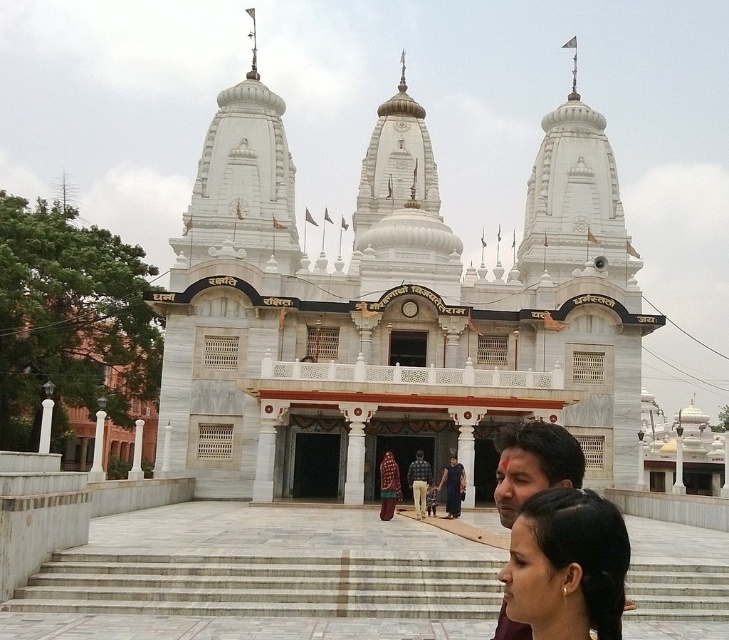
Question: From the image, what is the correct spatial relationship of white marble stairs at center in relation to black hair at lower center?

Choices:
 (A) below
 (B) above

Answer: (A)

Question: Which point is farther from the camera taking this photo?

Choices:
 (A) (389, 476)
 (B) (421, 488)
 (C) (534, 572)
 (D) (389, 580)

Answer: (B)

Question: Does white marble stairs at center have a lesser width compared to dark brown fabric dress at center?

Choices:
 (A) yes
 (B) no

Answer: (B)

Question: Among these objects, which one is farthest from the camera?

Choices:
 (A) dark brown fabric dress at center
 (B) black hair at lower center

Answer: (A)

Question: Does black hair at lower center have a smaller size compared to brown leather jacket at center?

Choices:
 (A) yes
 (B) no

Answer: (B)

Question: Which of the following is the farthest from the observer?

Choices:
 (A) white marble stairs at center
 (B) white marble hindu temple at center

Answer: (A)